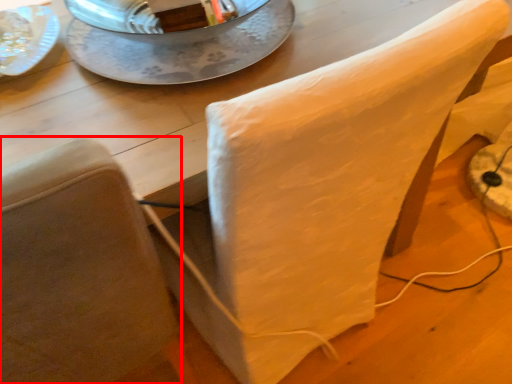
Question: From the image's perspective, where is chair (annotated by the red box) located in relation to glass plate in the image?

Choices:
 (A) above
 (B) below

Answer: (B)